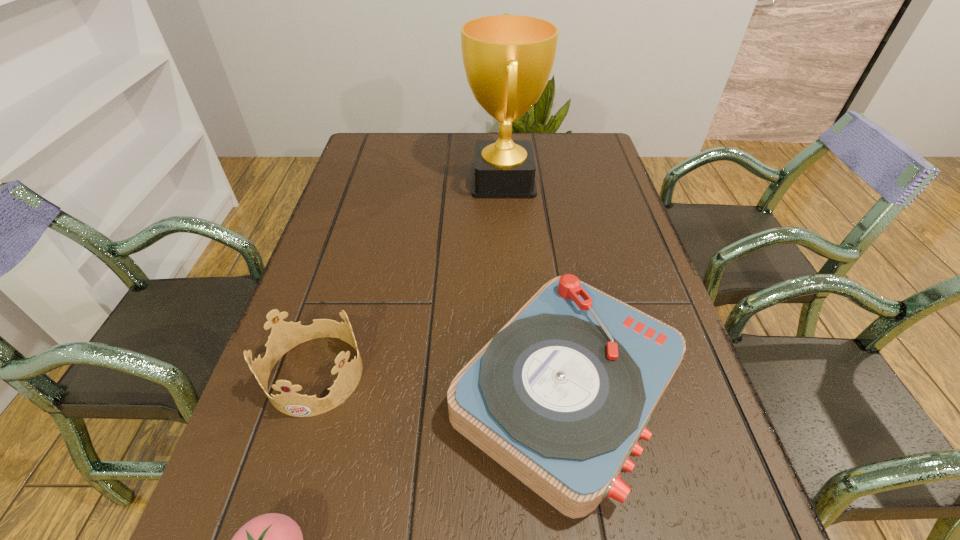
Find the location of a particular element. This screenshot has height=540, width=960. free space between the record player and the award is located at coordinates (535, 287).

This screenshot has height=540, width=960. What are the coordinates of `vacant area that lies between the tallest object and the record player` in the screenshot? It's located at (535, 287).

Choose which object is the second nearest neighbor to the tiara. Please provide its 2D coordinates. Your answer should be formatted as a tuple, i.e. [(x, y)], where the tuple contains the x and y coordinates of a point satisfying the conditions above.

[(559, 397)]

You are a GUI agent. You are given a task and a screenshot of the screen. Output one action in this format:
    pyautogui.click(x=<x>, y=<y>)
    Task: Click on the object that ranks as the second closest to the record player
    This screenshot has height=540, width=960.
    Given the screenshot: What is the action you would take?
    pyautogui.click(x=272, y=539)

Identify the location of vacant region that satisfies the following two spatial constraints: 1. on the front-facing side of the farthest object; 2. on the front-facing side of the tiara. The width and height of the screenshot is (960, 540). [516, 374].

Locate an element on the screen. This screenshot has width=960, height=540. free location that satisfies the following two spatial constraints: 1. on the back side of the record player; 2. on the front-facing side of the tallest object is located at coordinates (533, 180).

Where is `free space that satisfies the following two spatial constraints: 1. on the front-facing side of the farthest object; 2. on the left side of the record player`? This screenshot has width=960, height=540. free space that satisfies the following two spatial constraints: 1. on the front-facing side of the farthest object; 2. on the left side of the record player is located at coordinates (517, 393).

Locate an element on the screen. vacant region that satisfies the following two spatial constraints: 1. on the front-facing side of the record player; 2. on the right side of the tiara is located at coordinates (310, 393).

Where is `blank area in the image that satisfies the following two spatial constraints: 1. on the front-facing side of the award; 2. on the front-facing side of the tiara`? blank area in the image that satisfies the following two spatial constraints: 1. on the front-facing side of the award; 2. on the front-facing side of the tiara is located at coordinates (516, 374).

Where is `free space that satisfies the following two spatial constraints: 1. on the front-facing side of the record player; 2. on the left side of the tallest object`? This screenshot has height=540, width=960. free space that satisfies the following two spatial constraints: 1. on the front-facing side of the record player; 2. on the left side of the tallest object is located at coordinates (517, 393).